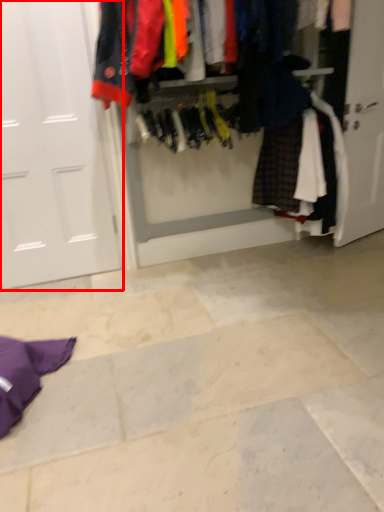
Question: From the image's perspective, what is the correct spatial relationship of door (annotated by the red box) in relation to closet?

Choices:
 (A) above
 (B) below

Answer: (B)